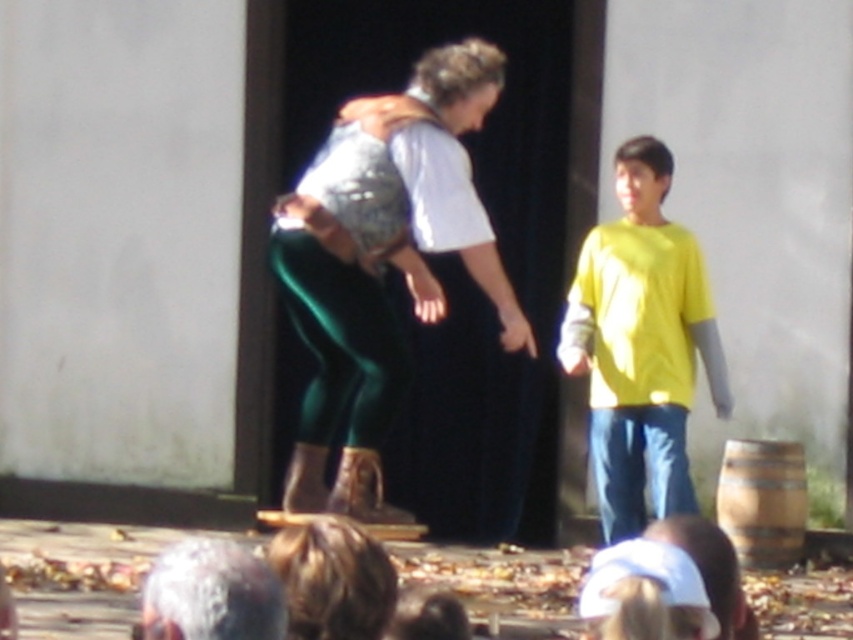
Is green velvet pants at center wider than yellow matte shirt at center?

Indeed, green velvet pants at center has a greater width compared to yellow matte shirt at center.

Can you confirm if green velvet pants at center is thinner than yellow matte shirt at center?

In fact, green velvet pants at center might be wider than yellow matte shirt at center.

The image size is (853, 640). I want to click on green velvet pants at center, so click(x=384, y=269).

In the scene shown: Does blonde hair at lower center appear under matte brown leather boots at lower center?

Incorrect, blonde hair at lower center is not positioned below matte brown leather boots at lower center.

Who is more distant from viewer, (368, 545) or (733, 550)?

Positioned behind is point (733, 550).

Identify the location of blonde hair at lower center. The height and width of the screenshot is (640, 853). (334, 579).

Which is above, yellow matte shirt at center or matte brown leather boots at lower center?

Positioned higher is yellow matte shirt at center.

Locate an element on the screen. Image resolution: width=853 pixels, height=640 pixels. yellow matte shirt at center is located at coordinates (641, 344).

At what (x,y) coordinates should I click in order to perform the action: click on yellow matte shirt at center. Please return your answer as a coordinate pair (x, y). Image resolution: width=853 pixels, height=640 pixels. Looking at the image, I should click on (641, 344).